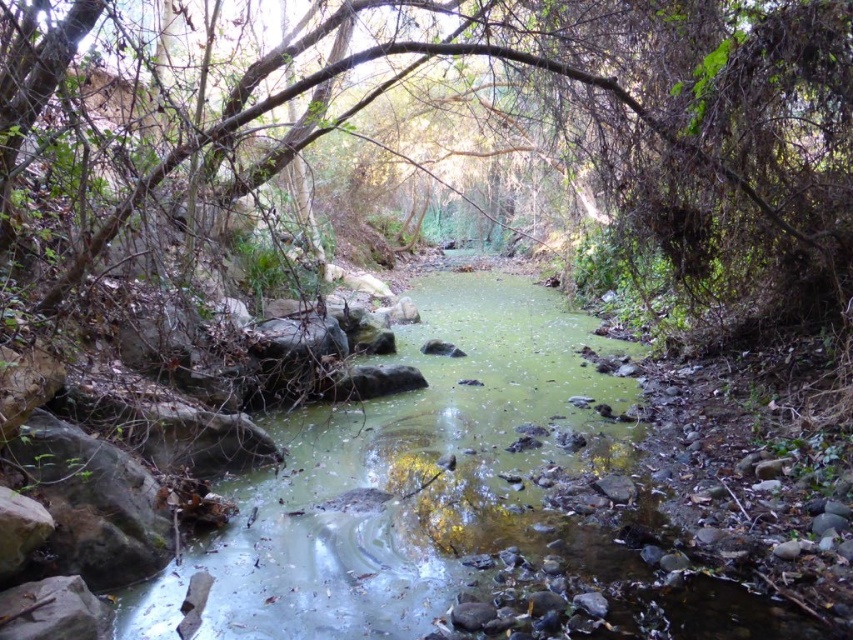
Question: Does green algae-covered water at center have a larger size compared to green leafy tree at center?

Choices:
 (A) no
 (B) yes

Answer: (B)

Question: In this image, where is green algae-covered water at center located relative to green leafy tree at center?

Choices:
 (A) left
 (B) right

Answer: (A)

Question: Which object appears closest to the camera in this image?

Choices:
 (A) green algae-covered water at center
 (B) green leafy tree at center

Answer: (A)

Question: Which object appears closest to the camera in this image?

Choices:
 (A) green algae-covered water at center
 (B) green leafy tree at center

Answer: (A)

Question: Does green algae-covered water at center appear under green leafy tree at center?

Choices:
 (A) yes
 (B) no

Answer: (A)

Question: Which point is closer to the camera?

Choices:
 (A) green leafy tree at center
 (B) green algae-covered water at center

Answer: (B)